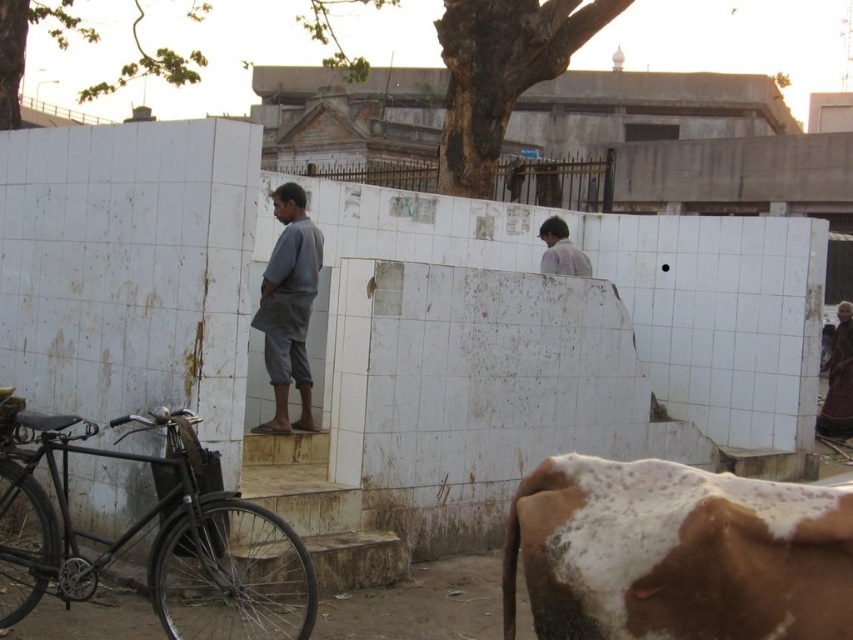
Question: Is black matte bicycle at left in front of purple cotton shirt at center?

Choices:
 (A) yes
 (B) no

Answer: (A)

Question: Is brown speckled hide at lower right positioned before gray cotton kurta at center?

Choices:
 (A) yes
 (B) no

Answer: (A)

Question: Which point is farther from the camera taking this photo?

Choices:
 (A) pyautogui.click(x=544, y=264)
 (B) pyautogui.click(x=219, y=566)
 (C) pyautogui.click(x=287, y=365)
 (D) pyautogui.click(x=782, y=493)

Answer: (A)

Question: Which object is positioned closest to the brown speckled hide at lower right?

Choices:
 (A) purple cotton shirt at center
 (B) black matte bicycle at left
 (C) gray cotton kurta at center

Answer: (B)

Question: Does black matte bicycle at left have a lesser width compared to gray cotton kurta at center?

Choices:
 (A) yes
 (B) no

Answer: (B)

Question: Which point is farther to the camera?

Choices:
 (A) (722, 579)
 (B) (282, 620)

Answer: (B)